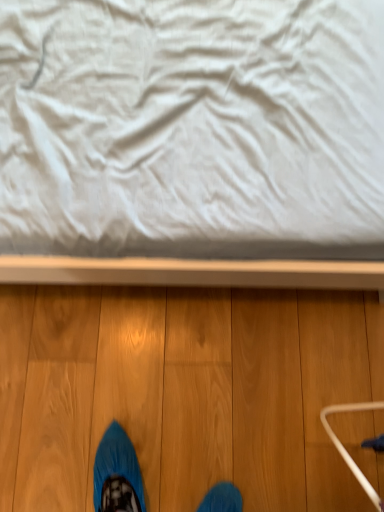
The height and width of the screenshot is (512, 384). What are the coordinates of `white fabric bed at upper center` in the screenshot? It's located at (192, 143).

Describe the element at coordinates (192, 143) in the screenshot. I see `white fabric bed at upper center` at that location.

In order to face white fabric bed at upper center, should I rotate leftwards or rightwards?

It's best to rotate left around 1.908 degrees.

Locate an element on the screen. This screenshot has height=512, width=384. white fabric bed at upper center is located at coordinates (192, 143).